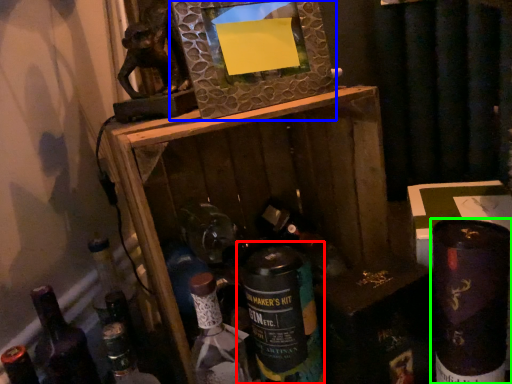
Question: Which object is positioned closest to bottle (highlighted by a red box)? Select from picture frame (highlighted by a blue box) and bottle (highlighted by a green box).

Choices:
 (A) picture frame
 (B) bottle

Answer: (B)